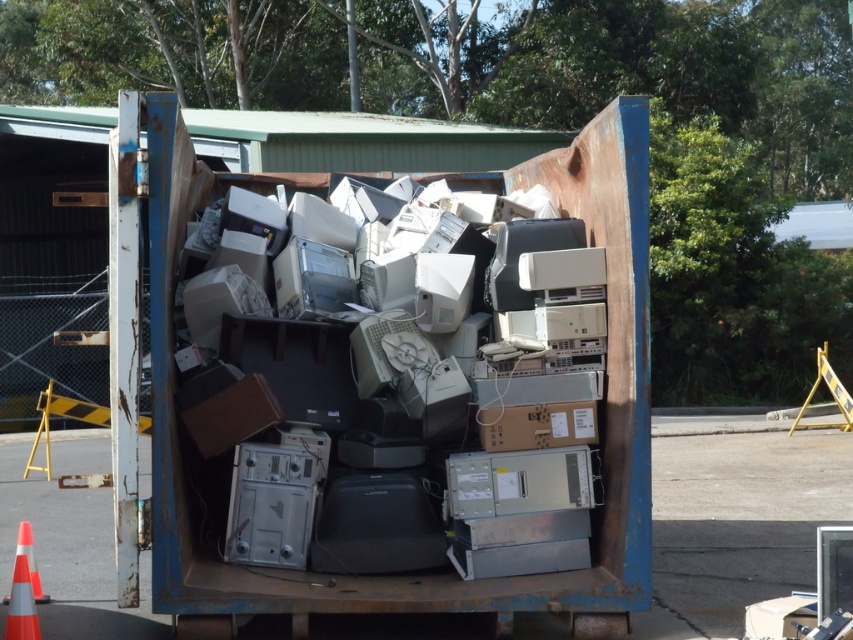
Question: Among these points, which one is farthest from the camera?

Choices:
 (A) (30, 582)
 (B) (32, 576)

Answer: (B)

Question: Is orange reflective cone at lower left to the left of orange/reflective traffic cone at lower left from the viewer's perspective?

Choices:
 (A) no
 (B) yes

Answer: (A)

Question: Does orange reflective cone at lower left have a smaller size compared to orange/reflective traffic cone at lower left?

Choices:
 (A) yes
 (B) no

Answer: (A)

Question: Among these objects, which one is farthest from the camera?

Choices:
 (A) orange reflective cone at lower left
 (B) orange/reflective traffic cone at lower left

Answer: (B)

Question: Does orange reflective cone at lower left appear over orange/reflective traffic cone at lower left?

Choices:
 (A) yes
 (B) no

Answer: (B)